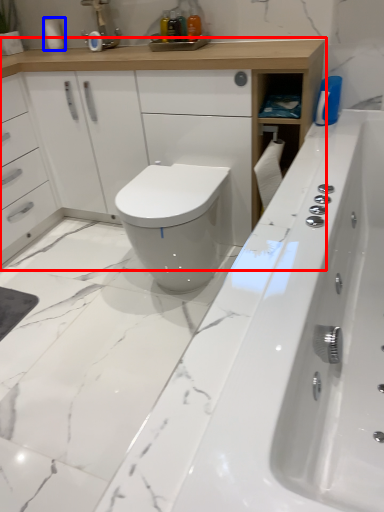
Question: Which object appears closest to the camera in this image, bathroom cabinet (highlighted by a red box) or toilet paper (highlighted by a blue box)?

Choices:
 (A) bathroom cabinet
 (B) toilet paper

Answer: (A)